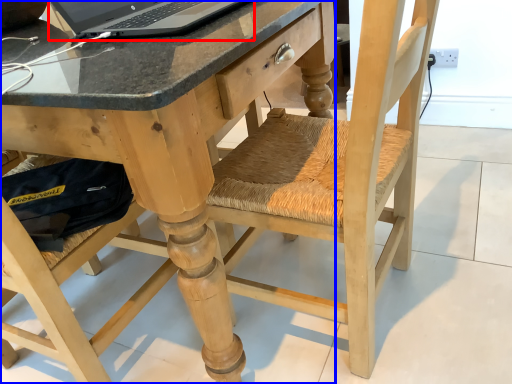
Question: Which object appears farthest to the camera in this image, laptop (highlighted by a red box) or desk (highlighted by a blue box)?

Choices:
 (A) laptop
 (B) desk

Answer: (A)